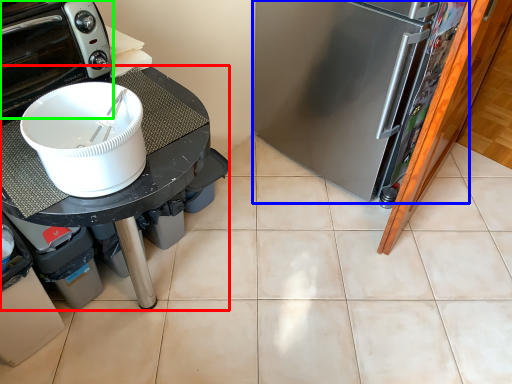
Question: Considering the real-world distances, which object is farthest from table (highlighted by a red box)? refrigerator (highlighted by a blue box) or home appliance (highlighted by a green box)?

Choices:
 (A) refrigerator
 (B) home appliance

Answer: (A)